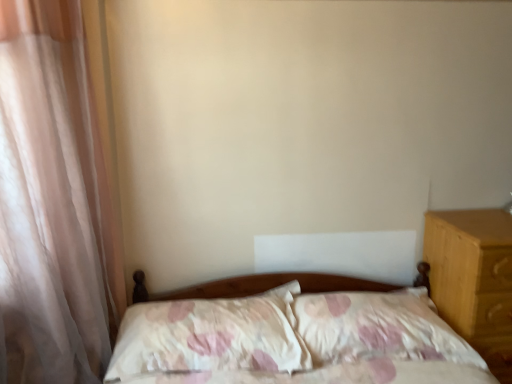
Question: From a real-world perspective, is fluffy white pillow at center, placed as the 1th pillow when sorted from right to left, physically located above or below fluffy white pillow at center, which is the 1th pillow in left-to-right order?

Choices:
 (A) above
 (B) below

Answer: (B)

Question: Is fluffy white pillow at center, placed as the 1th pillow when sorted from right to left, in front of or behind fluffy white pillow at center, which ranks as the second pillow in right-to-left order, in the image?

Choices:
 (A) behind
 (B) front

Answer: (A)

Question: Which of these objects is positioned closest to the fluffy white pillow at center, which is the 1th pillow in left-to-right order?

Choices:
 (A) sheer white curtain at left
 (B) fluffy white pillow at center, arranged as the second pillow when viewed from the left
 (C) light brown wood at right

Answer: (B)

Question: Based on their relative distances, which object is nearer to the fluffy white pillow at center, which ranks as the second pillow in right-to-left order?

Choices:
 (A) fluffy white pillow at center, arranged as the second pillow when viewed from the left
 (B) light brown wood at right
 (C) sheer white curtain at left

Answer: (A)